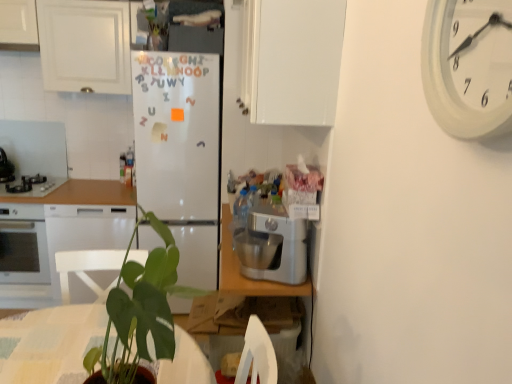
Question: Based on their sizes in the image, would you say brushed metal stove at left, marked as the second appliance in a bottom-to-top arrangement, is bigger or smaller than silver metallic stand mixer at center?

Choices:
 (A) small
 (B) big

Answer: (A)

Question: From the image's perspective, is brushed metal stove at left, the first appliance when ordered from top to bottom, located above or below silver metallic stand mixer at center?

Choices:
 (A) below
 (B) above

Answer: (B)

Question: Considering the real-world distances, which object is closest to the green matte plant at center?

Choices:
 (A) silver metallic stand mixer at center
 (B) white glossy cabinet at upper left, which is the 2th cabinetry in front-to-back order
 (C) wooden countertop at left
 (D) white plastic clock at upper right
 (E) black glass cooktop at left, arranged as the 1th appliance when ordered from the bottom

Answer: (A)

Question: Considering the real-world distances, which object is farthest from the white glossy cabinet at upper left, acting as the 1th cabinetry starting from the left?

Choices:
 (A) green matte plant at center
 (B) white plastic clock at upper right
 (C) wooden countertop at left
 (D) white matte refrigerator at center
 (E) silver metallic stand mixer at center

Answer: (B)